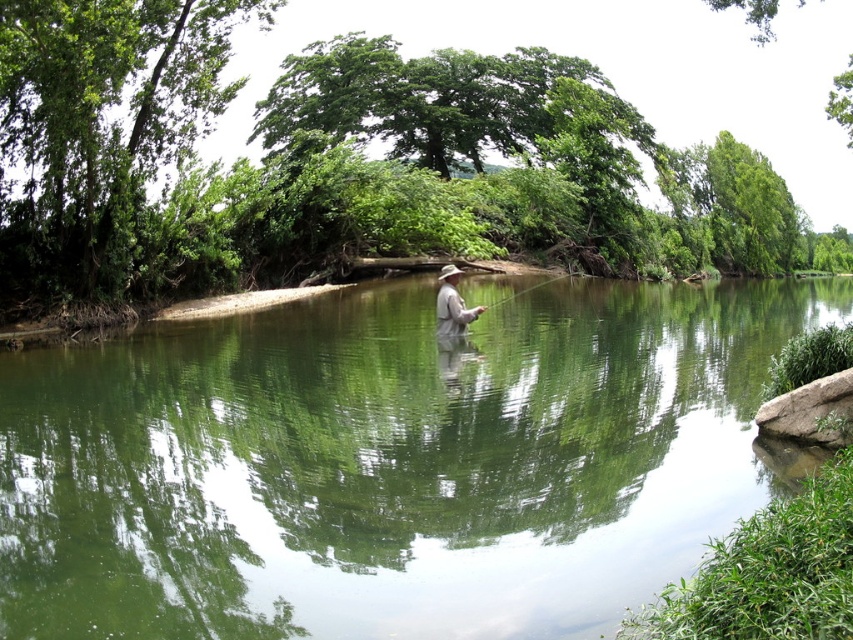
Which is behind, point (479, 621) or point (451, 266)?

Point (451, 266)

Which is more to the left, green smooth water at center or matte brown hat at center?

matte brown hat at center is more to the left.

Find the location of a particular element. green smooth water at center is located at coordinates (392, 461).